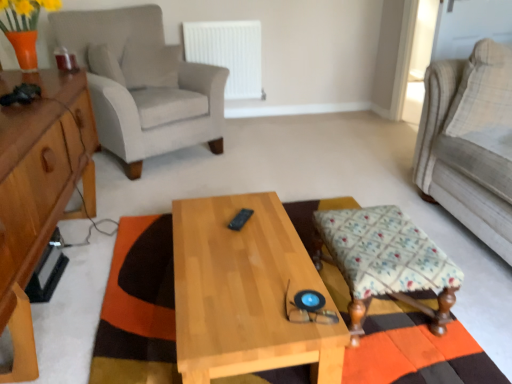
The image size is (512, 384). In order to click on free space in front of floral fabric stool at lower right in this screenshot , I will do `click(421, 360)`.